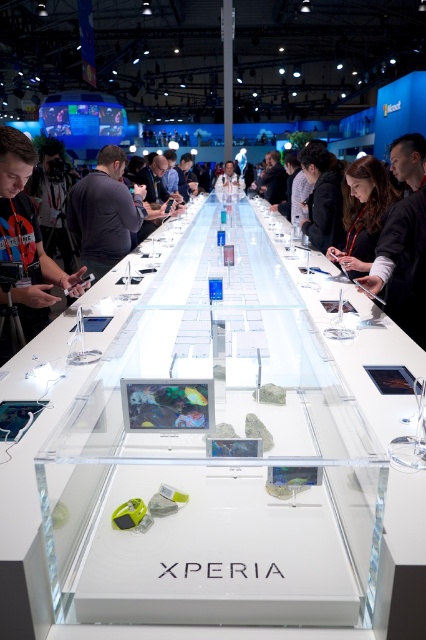
You are a photographer setting up for a product shoot at the Sony Xperia booth. You need to position a light source above the transparent acrylic table at center so that it illuminates the table without casting a shadow of the black fabric person at center. Is this possible given their heights?

The transparent acrylic table at center has a greater height compared to the black fabric person at center. Since the table is taller, positioning the light source above it would ensure that the light can illuminate the table while the shorter black fabric person at center won

You are a photographer at the Sony Xperia booth and need to capture a clear photo of both the dark gray shirt at center and the black fabric jacket at center. Which one should you focus on first if you want to ensure both are in focus without moving the camera?

The dark gray shirt at center is positioned on the left side of black fabric jacket at center, so focusing on the dark gray shirt at center first will ensure both are within the depth of field since it is closer to the camera.

You are a fashion designer visiting the Sony Xperia booth. You notice the dark gray fabric shirt at left and the black fabric jacket at center. Which piece of clothing is larger?

The black fabric jacket at center is larger than the dark gray fabric shirt at left.